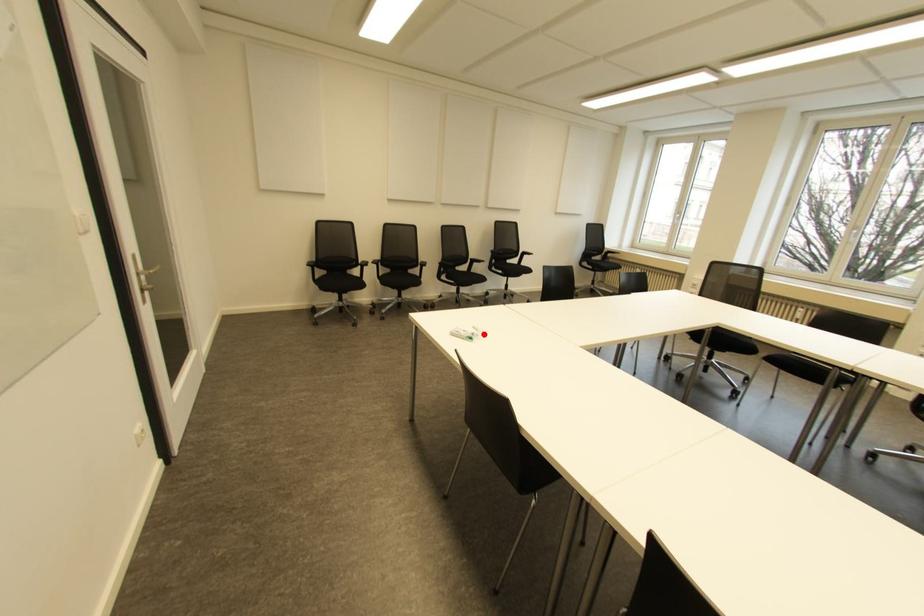
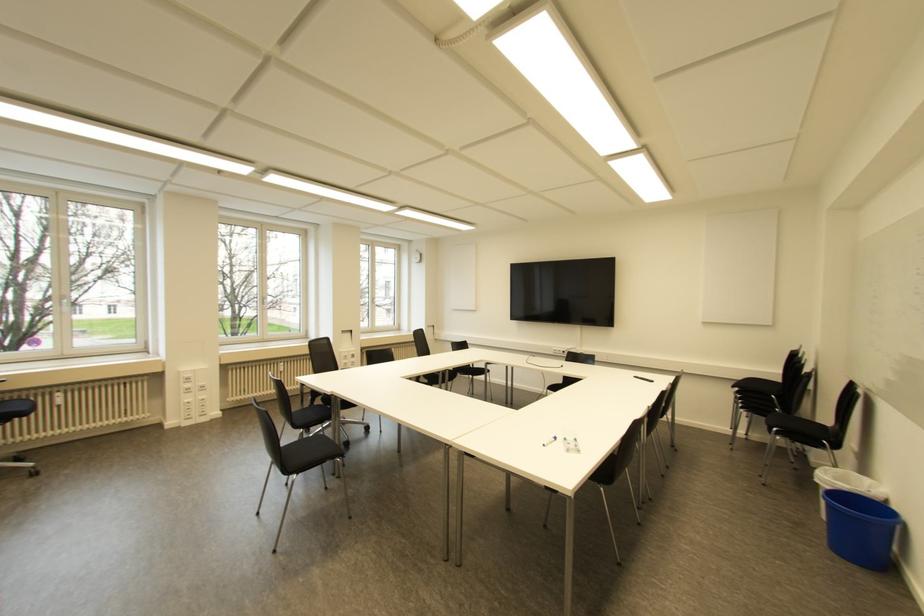
Locate, in the second image, the point that corresponds to the highlighted location in the first image.

(554, 438)